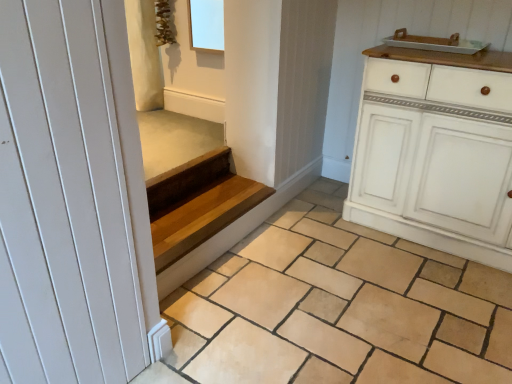
Question: Is the depth of natural stone tile at center less than that of wooden stairs at center?

Choices:
 (A) no
 (B) yes

Answer: (B)

Question: Is natural stone tile at center wider than wooden stairs at center?

Choices:
 (A) yes
 (B) no

Answer: (A)

Question: Does natural stone tile at center lie behind wooden stairs at center?

Choices:
 (A) yes
 (B) no

Answer: (B)

Question: Is natural stone tile at center positioned beyond the bounds of wooden stairs at center?

Choices:
 (A) yes
 (B) no

Answer: (A)

Question: Is natural stone tile at center looking in the opposite direction of wooden stairs at center?

Choices:
 (A) no
 (B) yes

Answer: (A)

Question: Looking at their shapes, would you say natural stone tile at center is wider or thinner than white ceramic tray at upper right?

Choices:
 (A) thin
 (B) wide

Answer: (B)

Question: Considering the positions of natural stone tile at center and white ceramic tray at upper right in the image, is natural stone tile at center bigger or smaller than white ceramic tray at upper right?

Choices:
 (A) big
 (B) small

Answer: (A)

Question: Visually, is natural stone tile at center positioned to the left or to the right of white ceramic tray at upper right?

Choices:
 (A) right
 (B) left

Answer: (B)

Question: Considering the positions of point coord(401,332) and point coord(407,44), is point coord(401,332) closer or farther from the camera than point coord(407,44)?

Choices:
 (A) closer
 (B) farther

Answer: (A)

Question: Is white painted wood cabinet at right taller or shorter than natural stone tile at center?

Choices:
 (A) short
 (B) tall

Answer: (B)

Question: In the image, is white painted wood cabinet at right positioned in front of or behind natural stone tile at center?

Choices:
 (A) behind
 (B) front

Answer: (A)

Question: Is point (504, 130) closer or farther from the camera than point (448, 301)?

Choices:
 (A) farther
 (B) closer

Answer: (B)

Question: Would you say white painted wood cabinet at right is inside or outside natural stone tile at center?

Choices:
 (A) inside
 (B) outside

Answer: (B)

Question: Do you think white ceramic tray at upper right is within white smooth door at left, or outside of it?

Choices:
 (A) outside
 (B) inside

Answer: (A)

Question: Considering the relative positions of white ceramic tray at upper right and white smooth door at left in the image provided, is white ceramic tray at upper right to the left or to the right of white smooth door at left?

Choices:
 (A) left
 (B) right

Answer: (B)